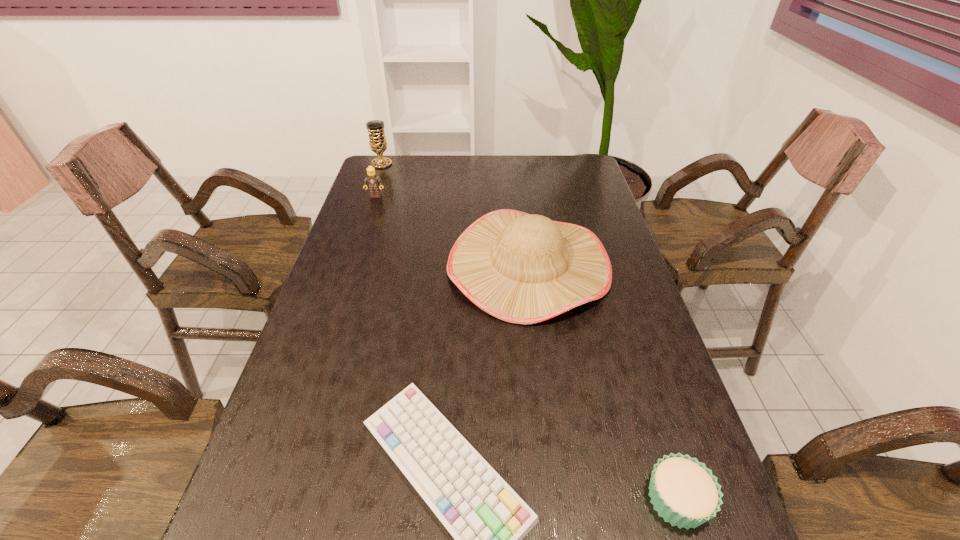
At what (x,y) coordinates should I click in order to perform the action: click on empty location between the cupcake and the second farthest object. Please return your answer as a coordinate pair (x, y). Looking at the image, I should click on (526, 348).

Identify the location of free space between the third nearest object and the Lego. The width and height of the screenshot is (960, 540). (452, 231).

Locate an element on the screen. vacant space in between the fourth tallest object and the third nearest object is located at coordinates (603, 382).

Locate an element on the screen. This screenshot has height=540, width=960. object that is the second closest to the chalice is located at coordinates (522, 268).

Locate an element on the screen. object identified as the closest to the shortest object is located at coordinates (522, 268).

You are a GUI agent. You are given a task and a screenshot of the screen. Output one action in this format:
    pyautogui.click(x=<x>, y=<y>)
    Task: Click on the vacant space that satisfies the following two spatial constraints: 1. in front of the sunhat; 2. on the left side of the third shortest object
    This screenshot has height=540, width=960.
    Given the screenshot: What is the action you would take?
    pyautogui.click(x=352, y=265)